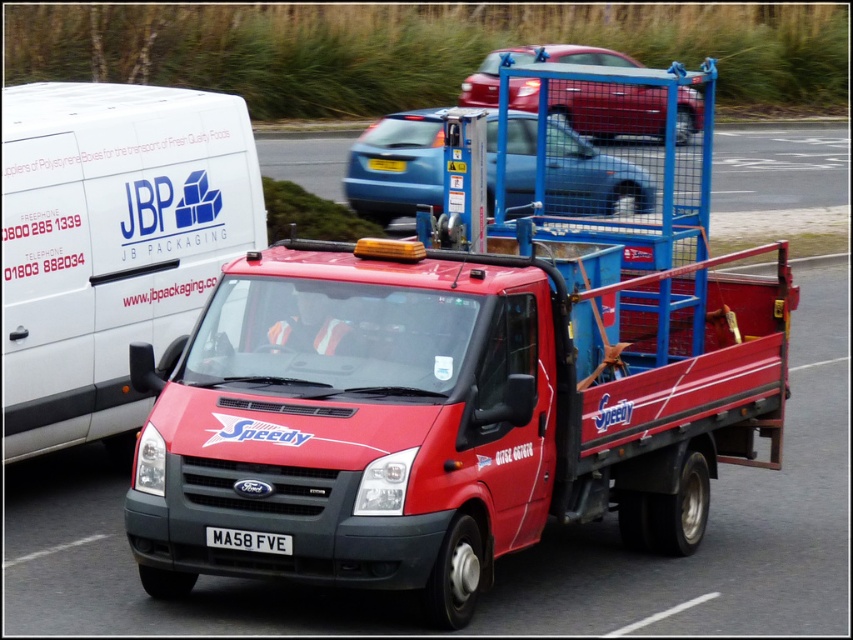
You are a delivery driver who needs to navigate between two points marked on the road ahead. The first point is at coordinate point (572, 483), and the second is at point (212, 529). Which point is closer to your current position as you drive towards them?

Point (572, 483) is closer to you than point (212, 529) because it is further to the viewer, meaning it is nearer in the scene.

You are a delivery driver who needs to load a package onto the red matte truck at center. The loading dock is located at point [444,412]. Can you confirm if the red matte truck at center is positioned correctly at the loading dock?

Yes, the red matte truck at center is positioned correctly at the loading dock because the coordinates provided indicate that the truck is exactly at point [444,412].